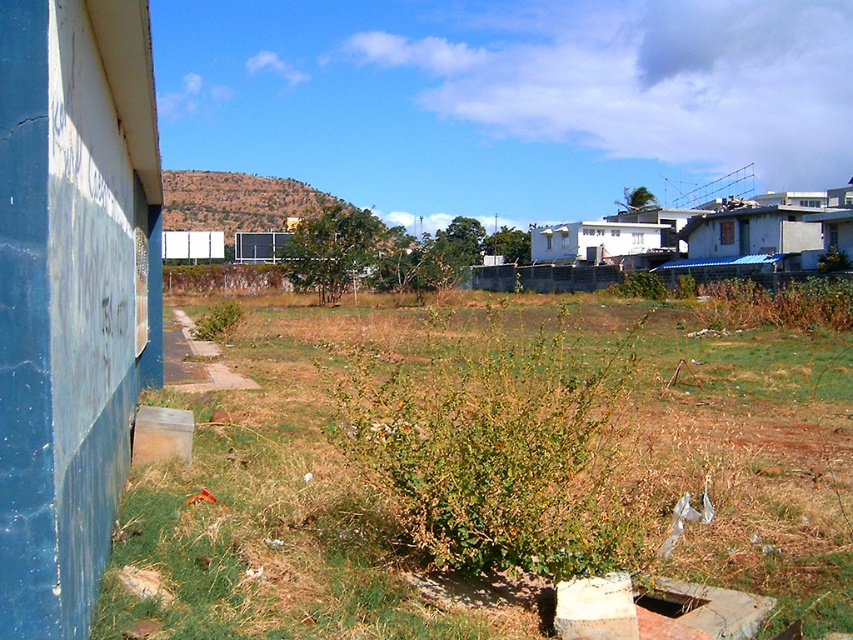
In the scene shown: You are a gardener trying to plant a new flower. You have a small shovel that can only reach areas not obstructed by grass. Can you dig into the dark brown concrete hole at lower center without moving the green grass at lower left?

The green grass at lower left is in front of the dark brown concrete hole at lower center, so you cannot dig into the dark brown concrete hole at lower center without moving the green grass at lower left first.

You are standing in the outdoor scene described. You want to place a 5 meter long ladder diagonally from the green leafy bush at center to the blue wall on the left. Is this possible without the ladder extending beyond the scene?

The green leafy bush at center is 4.43 meters from viewer. Since the ladder is 5 meters long, placing it diagonally from the bush to the blue wall on the left may be possible, but it depends on the distance between the bush and the wall. The description does not provide the distance to the wall, so we cannot confirm if the ladder will fit without extending beyond the scene.

You are a gardener looking at the outdoor scene. You see the green grass at lower left and the green leafy bush at center. Which one is positioned higher in the image?

The green grass at lower left is above the green leafy bush at center, so it is positioned higher in the image.